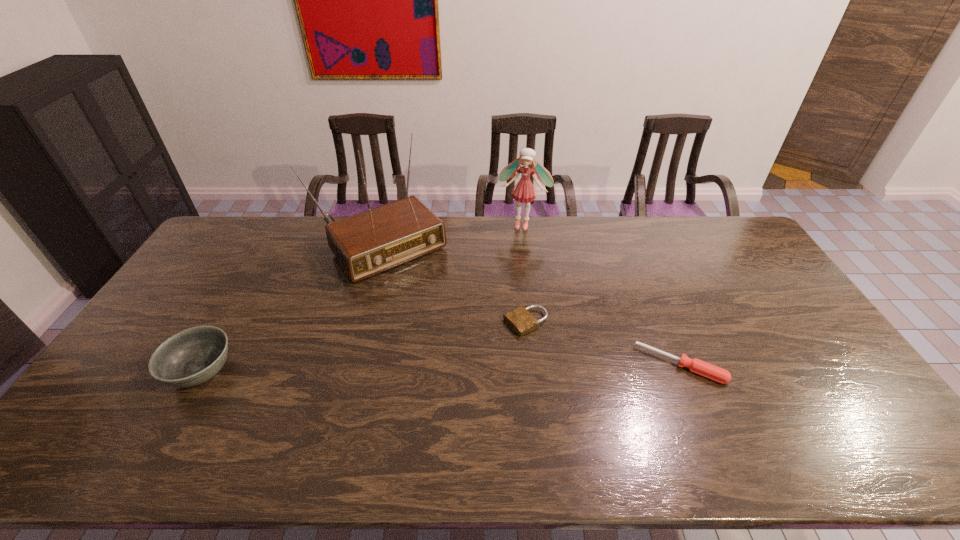
The image size is (960, 540). In order to click on free space between the second shortest object and the doll in this screenshot , I will do `click(602, 295)`.

The image size is (960, 540). I want to click on vacant area that lies between the doll and the third farthest object, so click(x=524, y=274).

What are the coordinates of `vacant area that lies between the padlock and the doll` in the screenshot? It's located at (524, 274).

You are a GUI agent. You are given a task and a screenshot of the screen. Output one action in this format:
    pyautogui.click(x=<x>, y=<y>)
    Task: Click on the empty location between the shortest object and the doll
    
    Given the screenshot: What is the action you would take?
    pyautogui.click(x=524, y=274)

The image size is (960, 540). I want to click on free space between the padlock and the radio_receiver, so click(452, 285).

This screenshot has width=960, height=540. Find the location of `free space between the second object from left to right and the padlock`. free space between the second object from left to right and the padlock is located at coordinates [x=452, y=285].

The width and height of the screenshot is (960, 540). I want to click on empty space between the leftmost object and the second shortest object, so click(x=441, y=368).

At what (x,y) coordinates should I click in order to perform the action: click on vacant space that's between the leftmost object and the third nearest object. Please return your answer as a coordinate pair (x, y). Looking at the image, I should click on (364, 347).

Where is `object that ranks as the second closest to the third shortest object`? The width and height of the screenshot is (960, 540). object that ranks as the second closest to the third shortest object is located at coordinates (520, 319).

Locate which object is the fourth closest to the bowl. Please provide its 2D coordinates. Your answer should be formatted as a tuple, i.e. [(x, y)], where the tuple contains the x and y coordinates of a point satisfying the conditions above.

[(705, 369)]